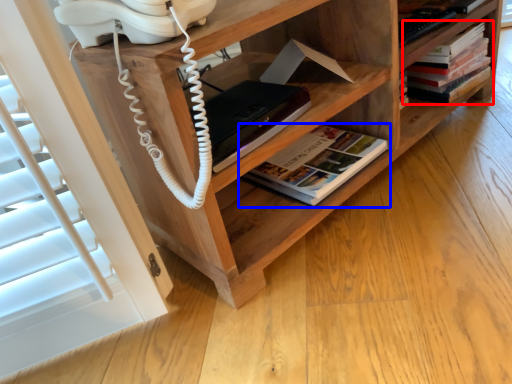
Question: Among these objects, which one is farthest to the camera, book (highlighted by a red box) or book (highlighted by a blue box)?

Choices:
 (A) book
 (B) book

Answer: (A)